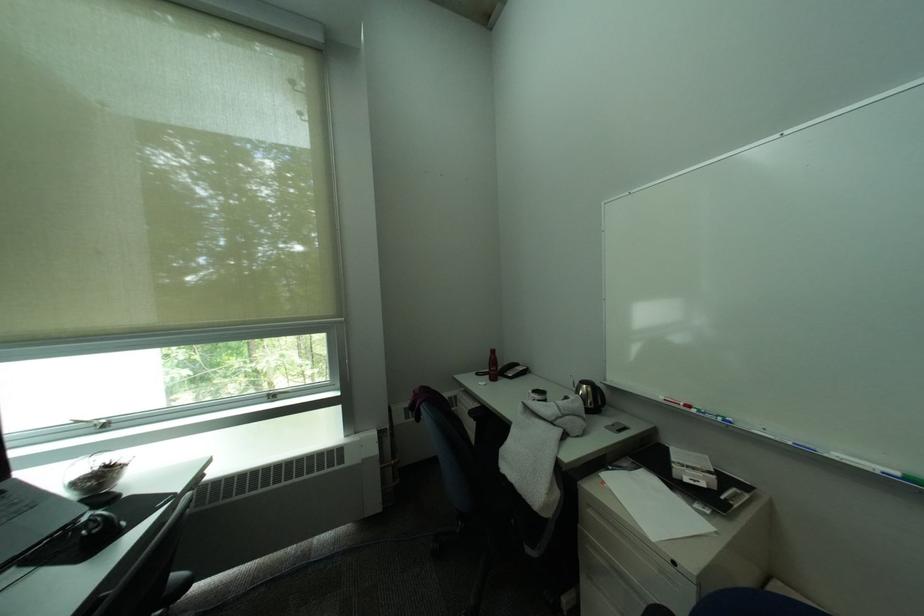
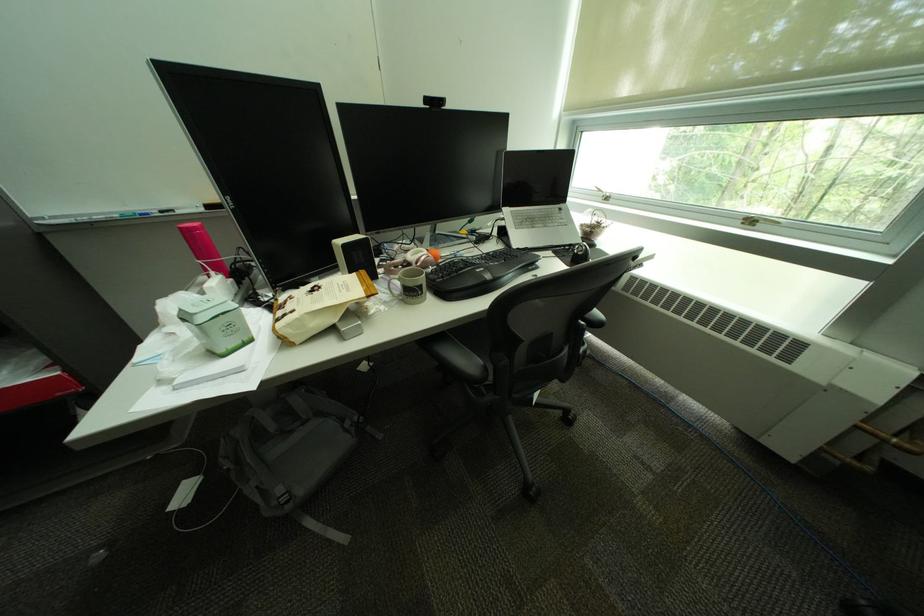
The point at [284,397] is marked in the first image. Where is the corresponding point in the second image?

(761, 224)